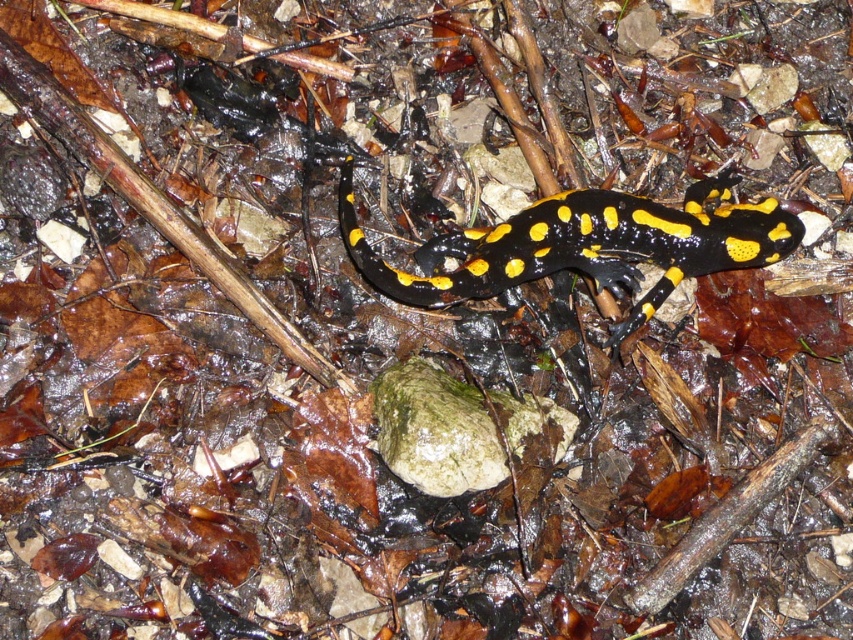
Question: Among these points, which one is nearest to the camera?

Choices:
 (A) (514, 232)
 (B) (384, 428)

Answer: (B)

Question: Which object appears closest to the camera in this image?

Choices:
 (A) green mossy rock at center
 (B) yellow-black spotted salamander at center

Answer: (A)

Question: Is yellow-black spotted salamander at center wider than green mossy rock at center?

Choices:
 (A) no
 (B) yes

Answer: (B)

Question: Does yellow-black spotted salamander at center have a larger size compared to green mossy rock at center?

Choices:
 (A) no
 (B) yes

Answer: (B)

Question: Does yellow-black spotted salamander at center have a lesser width compared to green mossy rock at center?

Choices:
 (A) yes
 (B) no

Answer: (B)